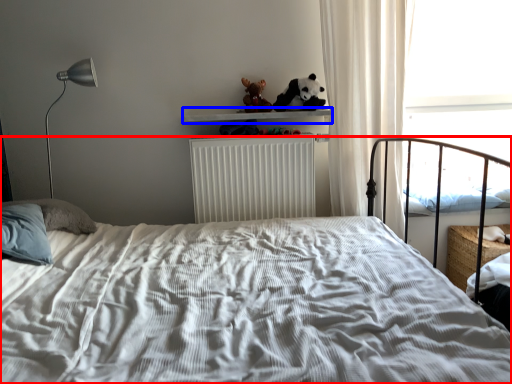
Question: Which object appears closest to the camera in this image, bed (highlighted by a red box) or window sill (highlighted by a blue box)?

Choices:
 (A) bed
 (B) window sill

Answer: (A)